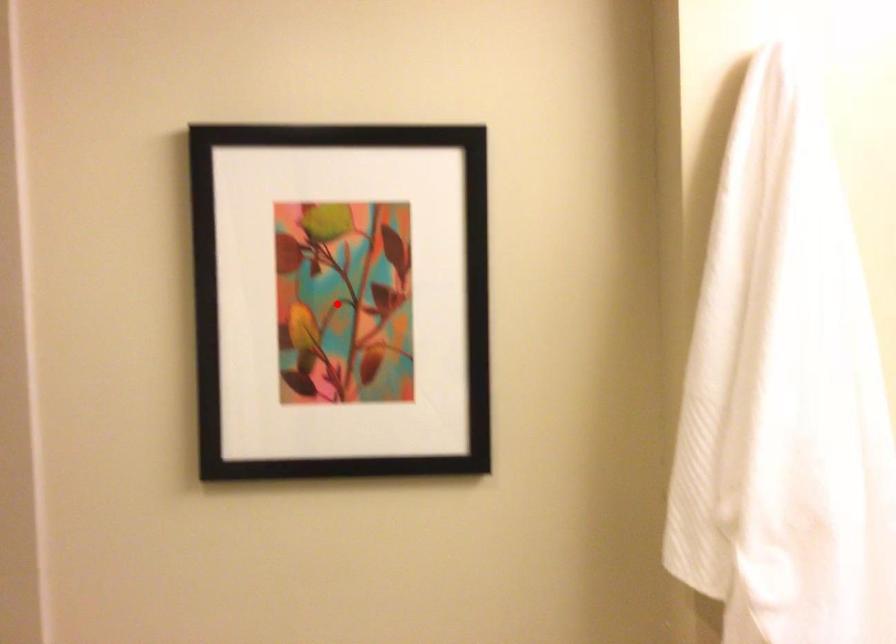
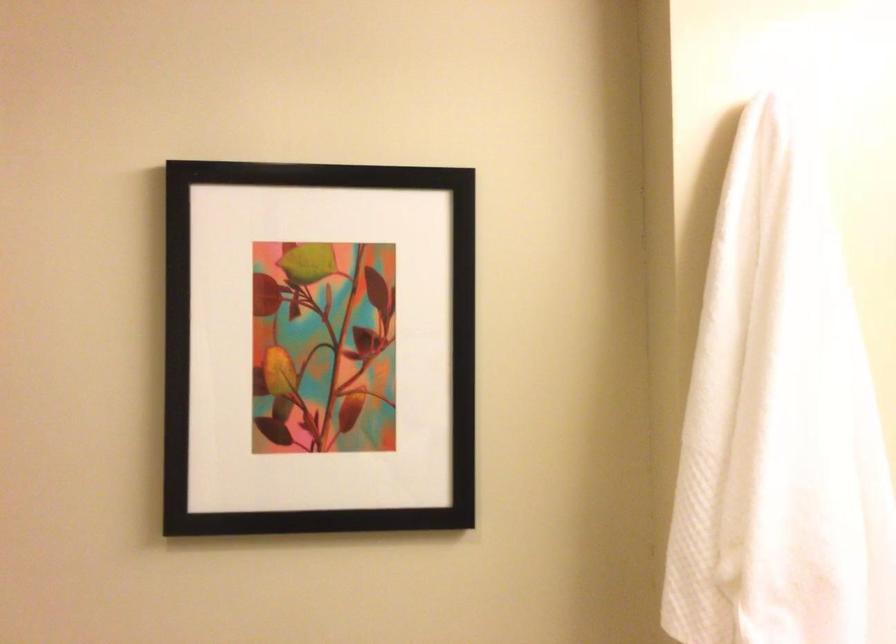
In the second image, find the point that corresponds to the highlighted location in the first image.

(317, 348)